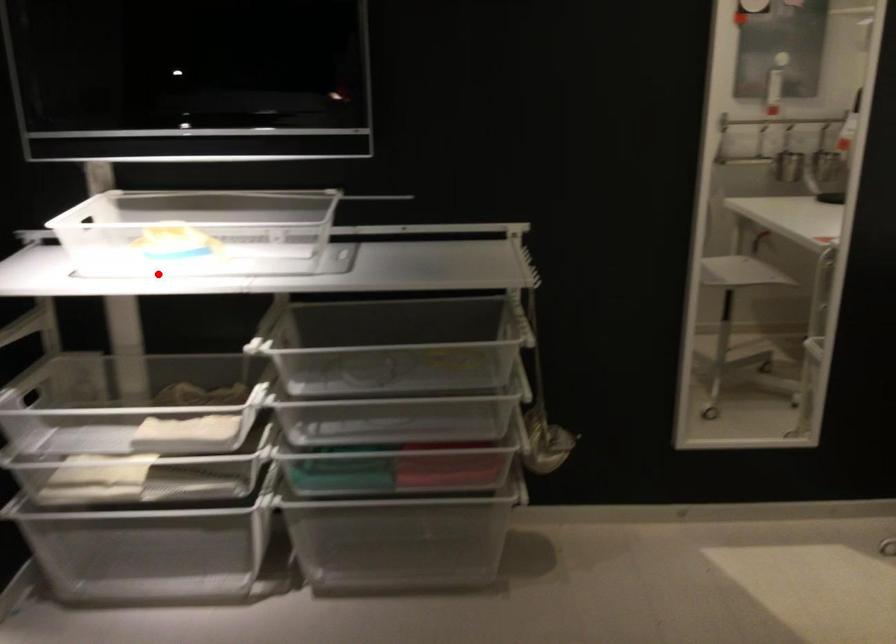
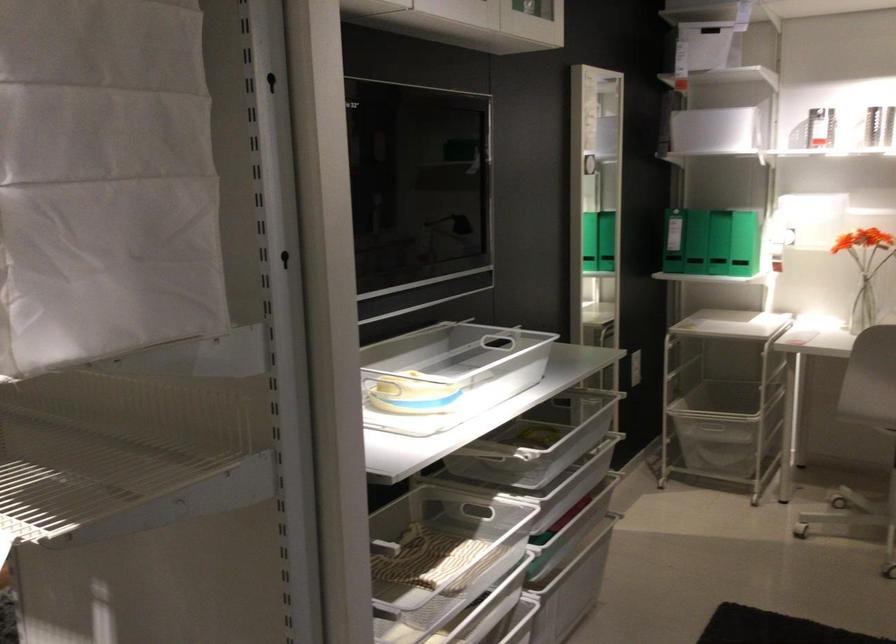
Find the pixel in the second image that matches the highlighted location in the first image.

(409, 392)